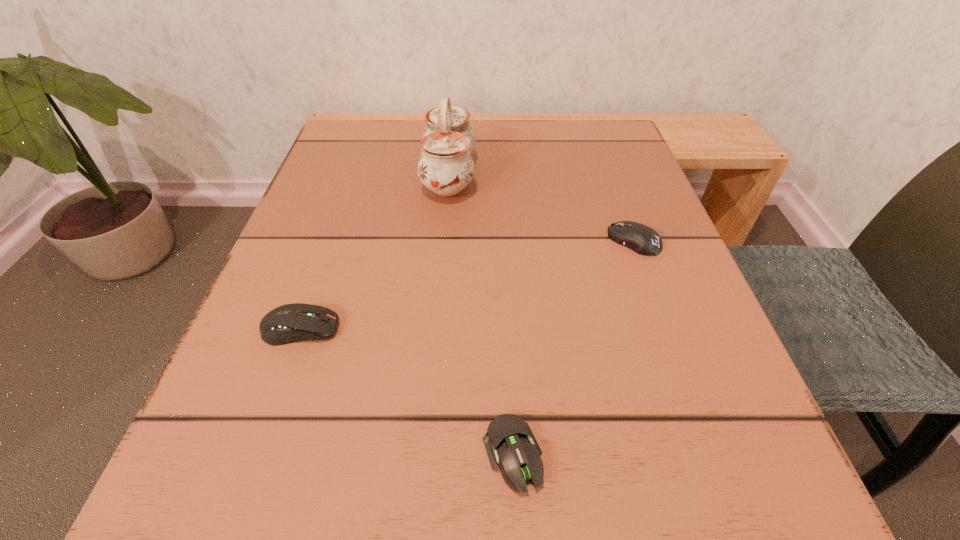
I want to click on object that stands as the closest to the second tallest object, so click(x=509, y=441).

Choose which computer mouse is the second nearest neighbor to the third object from left to right. Please provide its 2D coordinates. Your answer should be formatted as a tuple, i.e. [(x, y)], where the tuple contains the x and y coordinates of a point satisfying the conditions above.

[(640, 238)]

Locate which computer mouse ranks second in proximity to the rightmost object. Please provide its 2D coordinates. Your answer should be formatted as a tuple, i.e. [(x, y)], where the tuple contains the x and y coordinates of a point satisfying the conditions above.

[(295, 322)]

This screenshot has width=960, height=540. I want to click on vacant space that satisfies the following two spatial constraints: 1. on the front side of the second shortest object; 2. on the button of the second tallest object, so click(666, 329).

Locate an element on the screen. The height and width of the screenshot is (540, 960). vacant space that satisfies the following two spatial constraints: 1. by the handle of the farthest object; 2. on the back side of the shortest computer mouse is located at coordinates (424, 455).

Identify the location of vacant space that satisfies the following two spatial constraints: 1. on the button of the shortest computer mouse; 2. on the left side of the third shortest object. Image resolution: width=960 pixels, height=540 pixels. (255, 455).

You are a GUI agent. You are given a task and a screenshot of the screen. Output one action in this format:
    pyautogui.click(x=<x>, y=<y>)
    Task: Click on the vacant region that satisfies the following two spatial constraints: 1. by the handle of the farthest object; 2. on the right side of the second computer mouse from left to right
    
    Given the screenshot: What is the action you would take?
    pyautogui.click(x=424, y=455)

Locate an element on the screen. The height and width of the screenshot is (540, 960). free space that satisfies the following two spatial constraints: 1. by the handle of the shortest computer mouse; 2. on the left side of the third object from right to left is located at coordinates (424, 455).

Locate an element on the screen. This screenshot has height=540, width=960. free space in the image that satisfies the following two spatial constraints: 1. on the button of the second nearest object; 2. on the left side of the shortest object is located at coordinates (255, 455).

Identify the location of vacant space that satisfies the following two spatial constraints: 1. on the back side of the rightmost object; 2. on the right side of the shortest computer mouse. (501, 240).